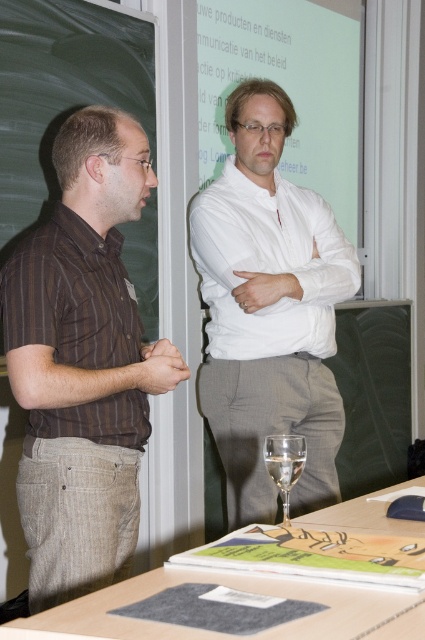
You are a photographer standing in front of the projection screen in the classroom. You notice two points marked on the screen at coordinates point (x=50, y=148) and point (x=297, y=464). Which point is closer to your camera lens?

Point (x=50, y=148) is further to the camera than point (x=297, y=464). Wait, the question asks which is closer to the camera. According to the description, point (x=50, y=148) is further away, so the closer one is point (x=297, y=464).

You are standing in the classroom and see the point marked at coordinates [82,362]. Which object is this point located on?

The point is located on the brown striped shirt at left.

You are standing in the classroom and want to reach the point marked at coordinates point (31,257). If your height is 1.7 meters, will you be able to see the projection screen clearly from there?

Result: The point (31,257) is 1.61 meters away from you. Since the projection screen is likely positioned at eye level or higher, and you are 1.7 meters tall, you should be able to see the projection screen clearly from that point as the distance is not too far and your height allows for a clear line of sight.